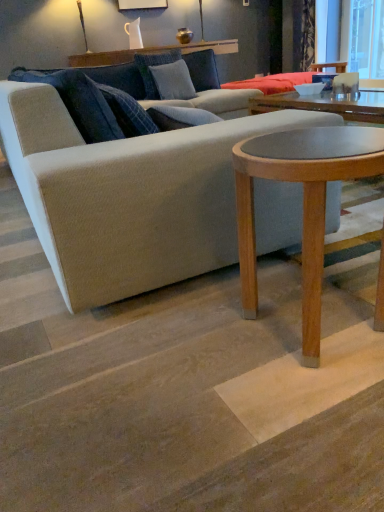
Where is `vacant space in light brown wood coffee table at center (from a real-world perspective)`? This screenshot has width=384, height=512. vacant space in light brown wood coffee table at center (from a real-world perspective) is located at coordinates (319, 323).